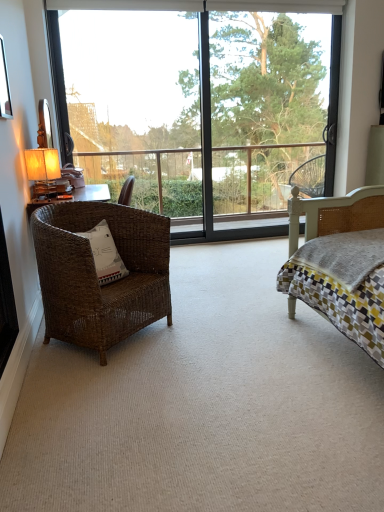
Where is `matte yellow fabric at left`? matte yellow fabric at left is located at coordinates (43, 170).

This screenshot has height=512, width=384. What do you see at coordinates (202, 109) in the screenshot?
I see `transparent glass window at center` at bounding box center [202, 109].

This screenshot has width=384, height=512. Describe the element at coordinates (96, 274) in the screenshot. I see `brown wicker chair at left` at that location.

Image resolution: width=384 pixels, height=512 pixels. Identify the location of metallic silver picture frame at upper left. (4, 86).

Describe the element at coordinates (4, 86) in the screenshot. The image size is (384, 512). I see `metallic silver picture frame at upper left` at that location.

Where is `matte yellow fabric at left`? The width and height of the screenshot is (384, 512). matte yellow fabric at left is located at coordinates (43, 170).

How different are the orientations of white cotton pillow at left and matte yellow fabric at left in degrees?

107 degrees.

Visually, is white cotton pillow at left positioned to the left or to the right of matte yellow fabric at left?

Clearly, white cotton pillow at left is on the right of matte yellow fabric at left in the image.

Is matte yellow fabric at left at the back of white cotton pillow at left?

white cotton pillow at left is not turned away from matte yellow fabric at left.

From the image's perspective, is white cotton pillow at left located above or below matte yellow fabric at left?

Clearly, from the image's perspective, white cotton pillow at left is below matte yellow fabric at left.

From a real-world perspective, is white cotton pillow at left positioned over brown wicker chair at left based on gravity?

Yes.

Can you tell me how much white cotton pillow at left and brown wicker chair at left differ in facing direction?

There is a 0.000941-degree angle between the facing directions of white cotton pillow at left and brown wicker chair at left.

Considering the relative sizes of white cotton pillow at left and brown wicker chair at left in the image provided, is white cotton pillow at left taller than brown wicker chair at left?

In fact, white cotton pillow at left may be shorter than brown wicker chair at left.

Is white cotton pillow at left oriented towards brown wicker chair at left?

Yes, white cotton pillow at left is facing brown wicker chair at left.

Considering the sizes of objects green leafy tree at upper center and matte yellow fabric at left in the image provided, who is shorter, green leafy tree at upper center or matte yellow fabric at left?

Standing shorter between the two is matte yellow fabric at left.

Is green leafy tree at upper center far from matte yellow fabric at left?

Yes, green leafy tree at upper center and matte yellow fabric at left are quite far apart.

In the scene shown: From a real-world perspective, is green leafy tree at upper center above or below matte yellow fabric at left?

Clearly, from a real-world perspective, green leafy tree at upper center is above matte yellow fabric at left.

Which object is positioned more to the right, green leafy tree at upper center or matte yellow fabric at left?

From the viewer's perspective, green leafy tree at upper center appears more on the right side.

In the scene shown: From a real-world perspective, is matte yellow fabric at left beneath metallic silver picture frame at upper left?

Indeed, from a real-world perspective, matte yellow fabric at left is positioned beneath metallic silver picture frame at upper left.

Is matte yellow fabric at left situated inside metallic silver picture frame at upper left or outside?

matte yellow fabric at left is outside metallic silver picture frame at upper left.

Identify the location of window on the right of the metallic silver picture frame at upper left. (202, 109).

Considering the relative sizes of transparent glass window at center and metallic silver picture frame at upper left in the image provided, is transparent glass window at center smaller than metallic silver picture frame at upper left?

No, transparent glass window at center is not smaller than metallic silver picture frame at upper left.

From the picture: Is transparent glass window at center shorter than metallic silver picture frame at upper left?

In fact, transparent glass window at center may be taller than metallic silver picture frame at upper left.

From a real-world perspective, is transparent glass window at center on metallic silver picture frame at upper left?

No, from a real-world perspective, transparent glass window at center is not above metallic silver picture frame at upper left.

At what (x,y) coordinates should I click in order to perform the action: click on pillow below the green leafy tree at upper center (from the image's perspective). Please return your answer as a coordinate pair (x, y). This screenshot has width=384, height=512. Looking at the image, I should click on (105, 254).

From the image's perspective, which object appears higher, white cotton pillow at left or green leafy tree at upper center?

From the image's view, green leafy tree at upper center is above.

Is white cotton pillow at left with green leafy tree at upper center?

white cotton pillow at left is not next to green leafy tree at upper center, and they're not touching.

From a real-world perspective, between white cotton pillow at left and green leafy tree at upper center, who is vertically higher?

From a 3D spatial view, green leafy tree at upper center is above.

Considering their positions, is transparent glass window at center located in front of or behind white cotton pillow at left?

Visually, transparent glass window at center is located behind white cotton pillow at left.

In order to click on window positioned vertically above the white cotton pillow at left (from a real-world perspective) in this screenshot , I will do `click(202, 109)`.

Looking at their sizes, would you say transparent glass window at center is wider or thinner than white cotton pillow at left?

Considering their sizes, transparent glass window at center looks slimmer than white cotton pillow at left.

Is transparent glass window at center oriented away from white cotton pillow at left?

No, transparent glass window at center is not facing the opposite direction of white cotton pillow at left.

The height and width of the screenshot is (512, 384). Identify the location of pillow on the right of matte yellow fabric at left. (105, 254).

You are a GUI agent. You are given a task and a screenshot of the screen. Output one action in this format:
    pyautogui.click(x=<x>, y=<y>)
    Task: Click on the pillow that appears behind the brown wicker chair at left
    The width and height of the screenshot is (384, 512).
    Given the screenshot: What is the action you would take?
    pyautogui.click(x=105, y=254)

Looking at the image, which one is located closer to green leafy tree at upper center, metallic silver picture frame at upper left or white cotton pillow at left?

metallic silver picture frame at upper left is positioned closer to the anchor green leafy tree at upper center.

Which object lies further to the anchor point white cotton pillow at left, brown wicker chair at left or matte yellow fabric at left?

Based on the image, matte yellow fabric at left appears to be further to white cotton pillow at left.

Which object lies nearer to the anchor point green leafy tree at upper center, matte yellow fabric at left or metallic silver picture frame at upper left?

Based on the image, matte yellow fabric at left appears to be nearer to green leafy tree at upper center.

Estimate the real-world distances between objects in this image. Which object is closer to transparent glass window at center, brown wicker chair at left or green leafy tree at upper center?

green leafy tree at upper center is positioned closer to the anchor transparent glass window at center.

Estimate the real-world distances between objects in this image. Which object is further from green leafy tree at upper center, white cotton pillow at left or metallic silver picture frame at upper left?

white cotton pillow at left.

When comparing their distances from green leafy tree at upper center, does white cotton pillow at left or brown wicker chair at left seem closer?

The object closer to green leafy tree at upper center is brown wicker chair at left.

Estimate the real-world distances between objects in this image. Which object is closer to green leafy tree at upper center, white cotton pillow at left or transparent glass window at center?

The object closer to green leafy tree at upper center is transparent glass window at center.

Estimate the real-world distances between objects in this image. Which object is further from green leafy tree at upper center, transparent glass window at center or brown wicker chair at left?

Among the two, brown wicker chair at left is located further to green leafy tree at upper center.

At what (x,y) coordinates should I click in order to perform the action: click on pillow between matte yellow fabric at left and green leafy tree at upper center. Please return your answer as a coordinate pair (x, y). The width and height of the screenshot is (384, 512). Looking at the image, I should click on (105, 254).

Locate an element on the screen. The width and height of the screenshot is (384, 512). pillow between metallic silver picture frame at upper left and green leafy tree at upper center along the z-axis is located at coordinates (105, 254).

Locate an element on the screen. The width and height of the screenshot is (384, 512). table lamp between brown wicker chair at left and transparent glass window at center along the z-axis is located at coordinates (43, 170).

Locate an element on the screen. window between matte yellow fabric at left and green leafy tree at upper center is located at coordinates pyautogui.click(x=202, y=109).